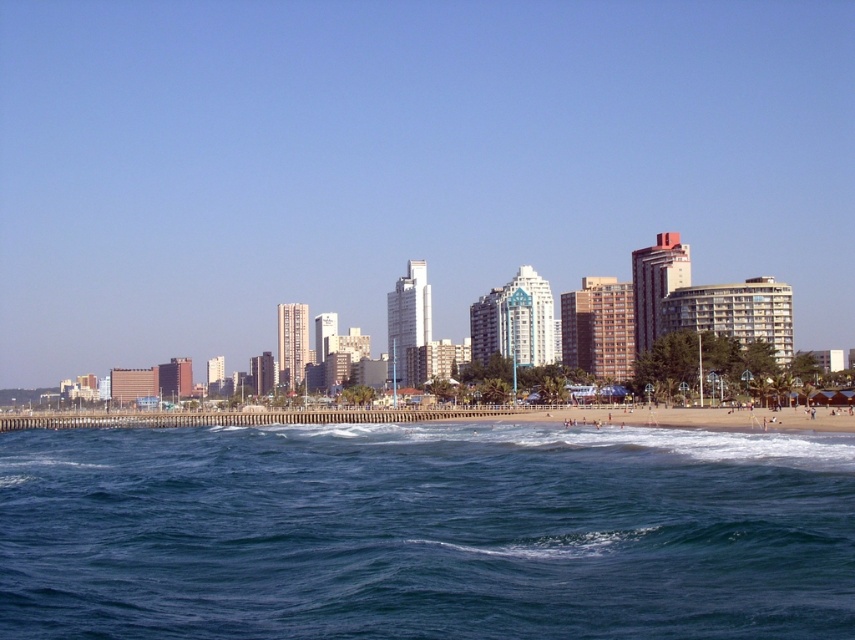
How far apart are blue water at lower center and smooth sand beach at lower center?

The distance of blue water at lower center from smooth sand beach at lower center is 38.34 meters.

Which is above, blue water at lower center or smooth sand beach at lower center?

Answer: blue water at lower center is higher up.

Consider the image. Who is more forward, (591,596) or (537,417)?

Point (591,596)

The image size is (855, 640). Identify the location of blue water at lower center. click(x=425, y=532).